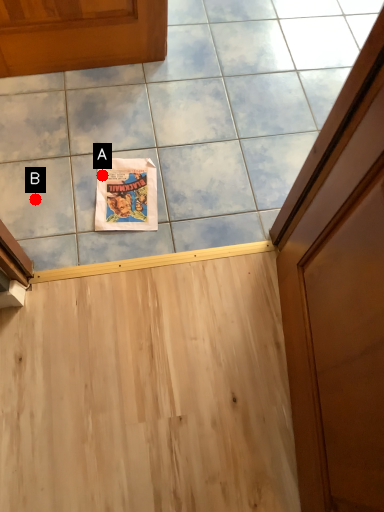
Question: Two points are circled on the image, labeled by A and B beside each circle. Which point is closer to the camera taking this photo?

Choices:
 (A) A is closer
 (B) B is closer

Answer: (B)